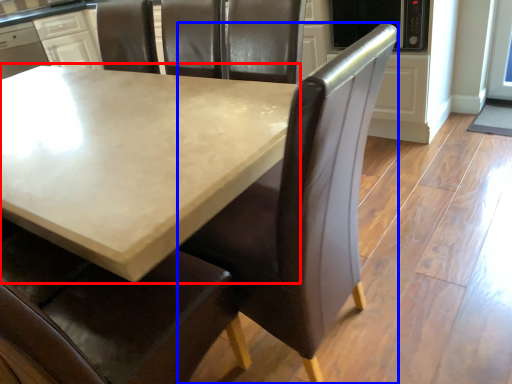
Question: Among these objects, which one is nearest to the camera, table (highlighted by a red box) or chair (highlighted by a blue box)?

Choices:
 (A) table
 (B) chair

Answer: (A)